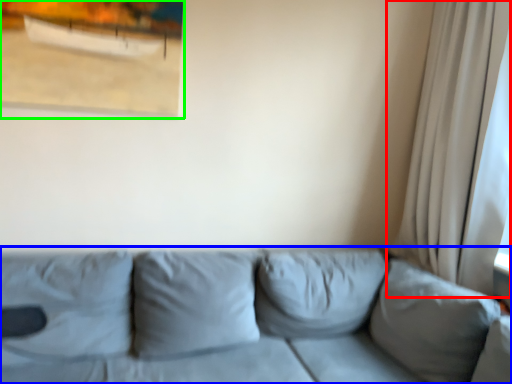
Question: Based on their relative distances, which object is nearer to curtain (highlighted by a red box)? Choose from studio couch (highlighted by a blue box) and picture frame (highlighted by a green box).

Choices:
 (A) studio couch
 (B) picture frame

Answer: (A)